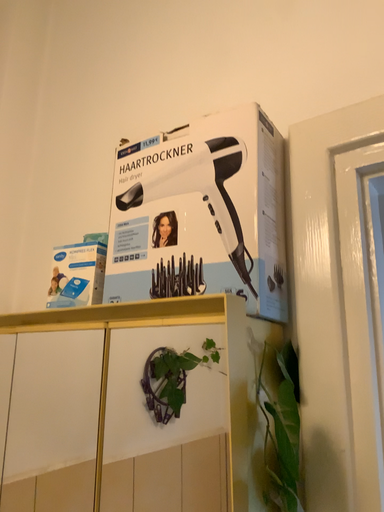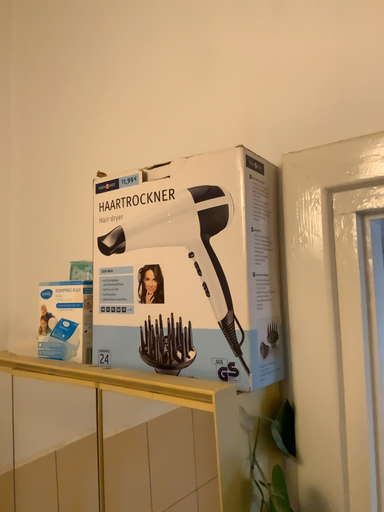
Question: How did the camera likely rotate when shooting the video?

Choices:
 (A) rotated upward
 (B) rotated downward

Answer: (B)